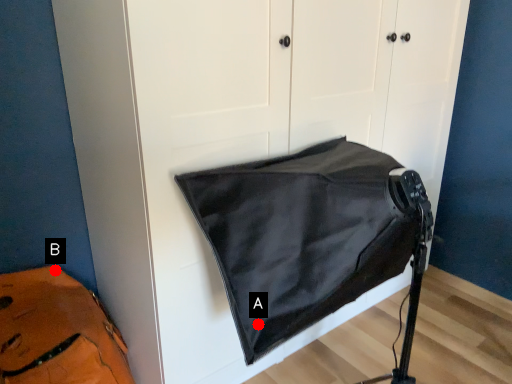
Question: Two points are circled on the image, labeled by A and B beside each circle. Among these points, which one is farthest from the camera?

Choices:
 (A) A is further
 (B) B is further

Answer: (B)